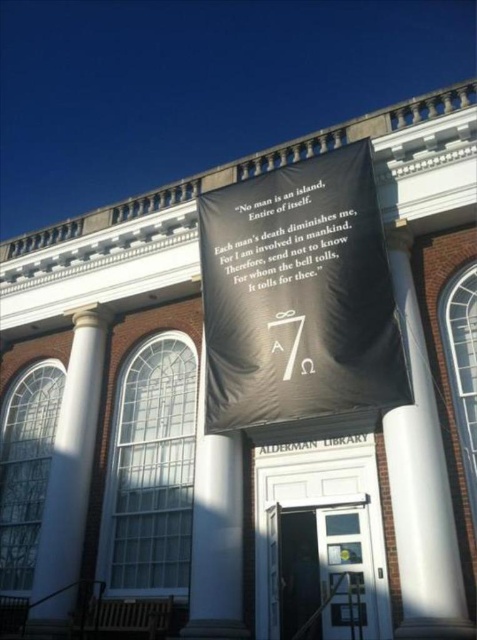
In the scene shown: Is black paper banner at center closer to camera compared to white marble pillar at center?

No, it is behind white marble pillar at center.

Does black paper banner at center have a lesser width compared to white marble pillar at center?

Incorrect, black paper banner at center's width is not less than white marble pillar at center's.

Is point (330, 259) in front of point (192, 608)?

No, it is not.

Identify the location of black paper banner at center. This screenshot has width=477, height=640. point(278,228).

Which of these two, black fabric banner at center or white smooth column at left, stands taller?

With more height is white smooth column at left.

Is point (206, 344) positioned in front of point (31, 628)?

No.

Find the location of `black fabric banner at center`. black fabric banner at center is located at coordinates (300, 301).

Between point (429, 376) and point (95, 358), which one is positioned in front?

Point (429, 376) is more forward.

Is white smooth column at center below white smooth column at left?

No, white smooth column at center is not below white smooth column at left.

Is point (418, 433) closer to viewer compared to point (71, 492)?

Yes, it is in front of point (71, 492).

Where is `white smooth column at center`? The image size is (477, 640). white smooth column at center is located at coordinates (421, 481).